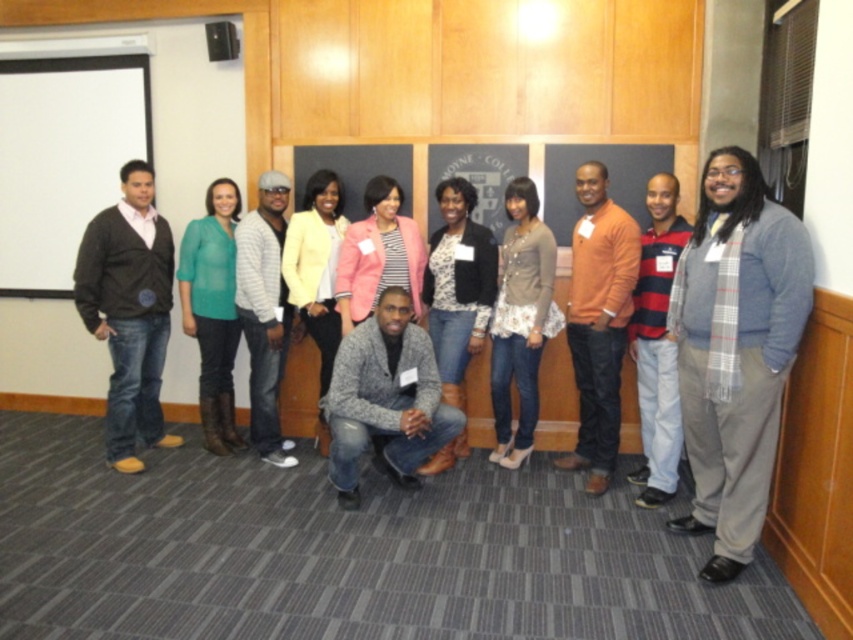
Question: Is light gray sweater at center positioned at the back of pink fabric jacket at center?

Choices:
 (A) no
 (B) yes

Answer: (B)

Question: Is orange sweater at center above light gray sweater at center?

Choices:
 (A) no
 (B) yes

Answer: (A)

Question: Based on their relative distances, which object is farther from the matte yellow blazer at center?

Choices:
 (A) teal matte shirt at center
 (B) denim jacket at center
 (C) striped knit sweater at right
 (D) matte gray cardigan at center

Answer: (C)

Question: Which object is the farthest from the teal matte shirt at center?

Choices:
 (A) matte gray cardigan at center
 (B) gray woolen sweater at center
 (C) denim jacket at center

Answer: (A)

Question: Considering the relative positions of white matte projector screen at left and orange sweater at center in the image provided, where is white matte projector screen at left located with respect to orange sweater at center?

Choices:
 (A) below
 (B) above

Answer: (B)

Question: Which of the following is the farthest from the observer?

Choices:
 (A) (457, 305)
 (B) (607, 365)

Answer: (A)